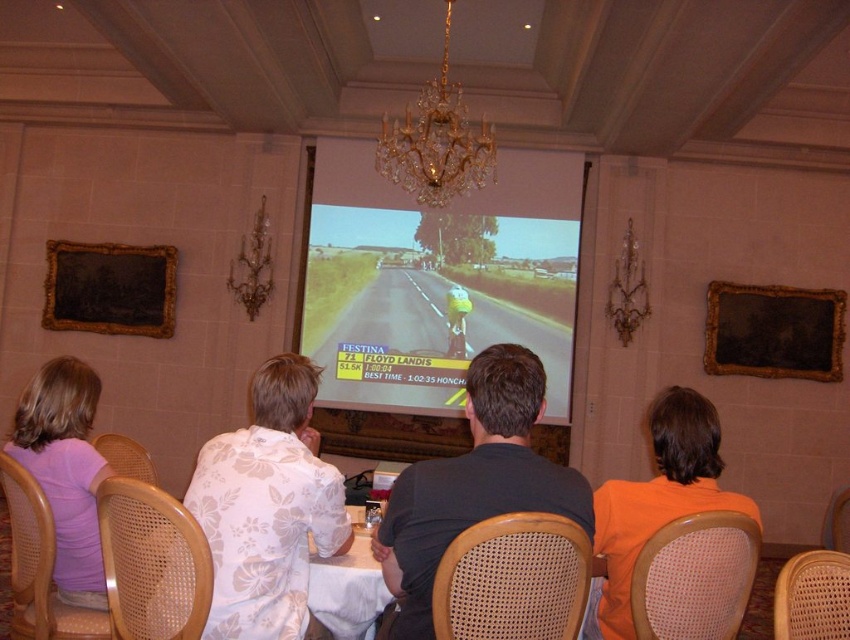
You are a guest at this formal event and want to take a photo of the gold crystal chandelier at upper center without including the dark blue shirt at center in the frame. How should you position yourself relative to the chandelier?

To avoid including the dark blue shirt at center in your photo, position yourself to the left of the gold crystal chandelier at upper center since the dark blue shirt at center is located to its right.